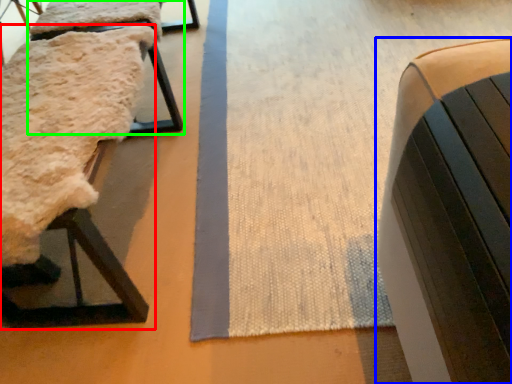
Question: Considering the real-world distances, which object is closest to furniture (highlighted by a red box)? furniture (highlighted by a blue box) or furniture (highlighted by a green box).

Choices:
 (A) furniture
 (B) furniture

Answer: (B)